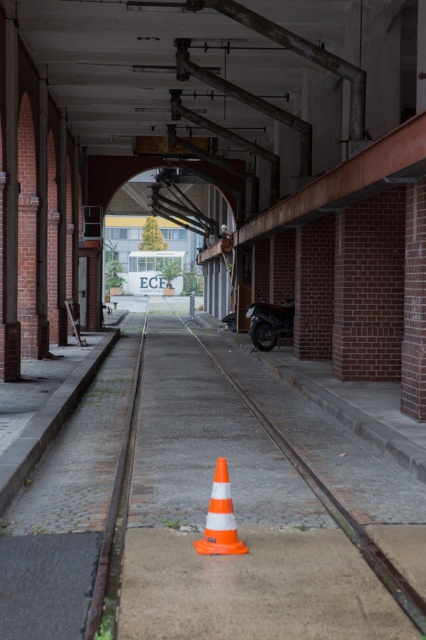
You are standing at the entrance of the walkway and want to place a new orange traffic cone exactly at the point marked as point (333,508). According to the scene description, where should you place the new orange traffic cone?

The point (333,508) corresponds to the orange plastic train track at center, so you should place the new orange traffic cone at the orange plastic train track at center.

You are standing at the tram track in the center of the walkway. You see two points marked on the wall. The first point is at coordinate point (307, 474) and the second point is at coordinate point (221, 531). Which point is closer to you?

Point (221, 531) is closer to you because the description states that point (307, 474) is behind point (221, 531).